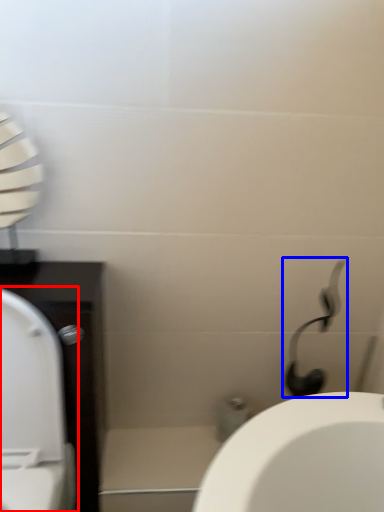
Question: Which object appears closest to the camera in this image, toilet (highlighted by a red box) or shower (highlighted by a blue box)?

Choices:
 (A) toilet
 (B) shower

Answer: (A)